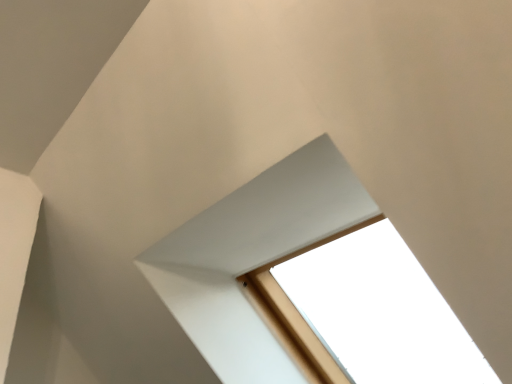
What do you see at coordinates (252, 256) in the screenshot? This screenshot has width=512, height=384. I see `transparent glass window at upper center` at bounding box center [252, 256].

The image size is (512, 384). I want to click on transparent glass window at upper center, so click(252, 256).

Find the location of `transparent glass window at upper center`. transparent glass window at upper center is located at coordinates (252, 256).